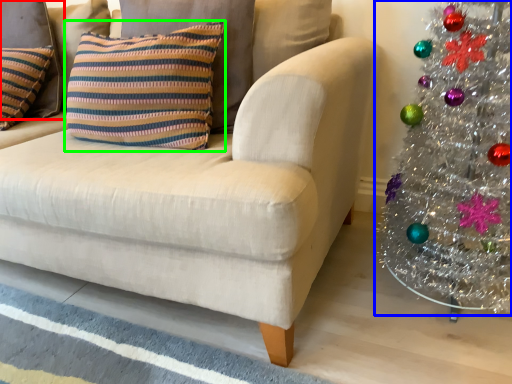
Question: Considering the real-world distances, which object is closest to pillow (highlighted by a red box)? christmas tree (highlighted by a blue box) or pillow (highlighted by a green box).

Choices:
 (A) christmas tree
 (B) pillow

Answer: (B)